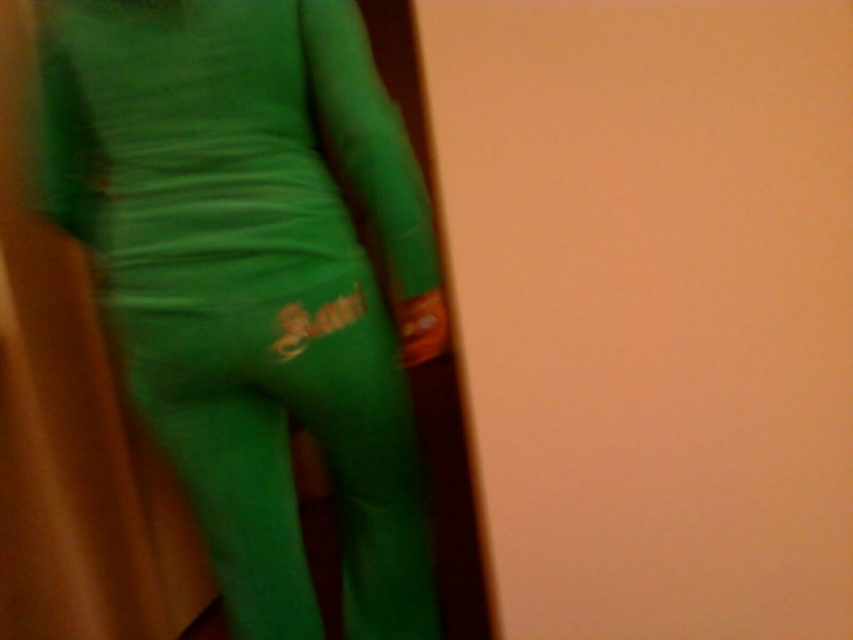
Question: Which point appears farthest from the camera in this image?

Choices:
 (A) (273, 561)
 (B) (332, 314)

Answer: (A)

Question: Can you confirm if green matte leggings at center is positioned below matte green pants at center?

Choices:
 (A) yes
 (B) no

Answer: (B)

Question: Among these objects, which one is farthest from the camera?

Choices:
 (A) matte green pants at center
 (B) green matte leggings at center

Answer: (A)

Question: Which point appears farthest from the camera in this image?

Choices:
 (A) (265, 544)
 (B) (383, 240)

Answer: (A)

Question: Does green matte leggings at center appear under matte green pants at center?

Choices:
 (A) no
 (B) yes

Answer: (A)

Question: Is green matte leggings at center smaller than matte green pants at center?

Choices:
 (A) yes
 (B) no

Answer: (B)